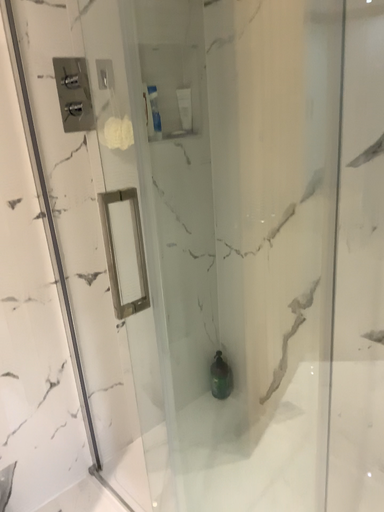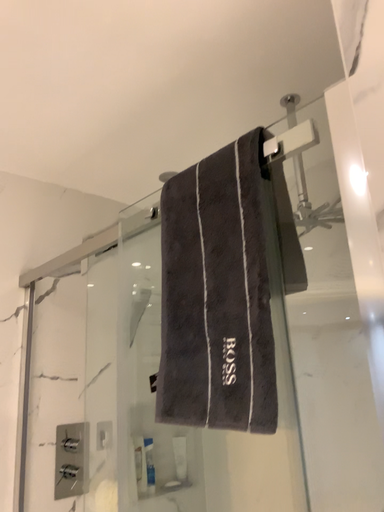
Question: Which way did the camera rotate in the video?

Choices:
 (A) rotated downward
 (B) rotated upward

Answer: (B)